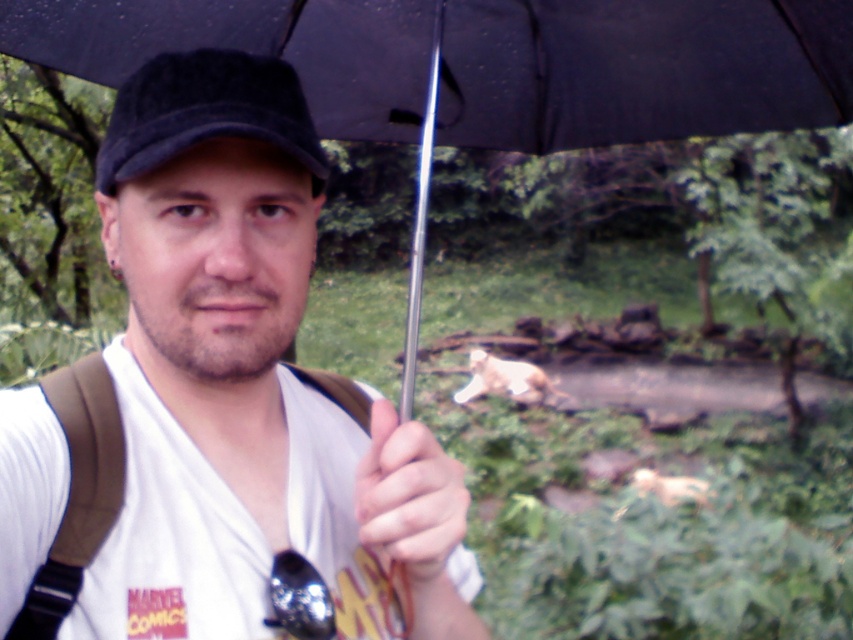
Based on the photo, can you confirm if black fuzzy baseball cap at center is positioned to the left of smooth skin hand at center?

Correct, you'll find black fuzzy baseball cap at center to the left of smooth skin hand at center.

Who is more forward, (155, 80) or (448, 484)?

Point (448, 484) is more forward.

Which is behind, point (315, 186) or point (401, 452)?

Point (315, 186)

You are a GUI agent. You are given a task and a screenshot of the screen. Output one action in this format:
    pyautogui.click(x=<x>, y=<y>)
    Task: Click on the black fuzzy baseball cap at center
    
    Given the screenshot: What is the action you would take?
    pyautogui.click(x=206, y=113)

Can you confirm if white matte t-shirt at center is bigger than smooth skin hand at center?

Yes, white matte t-shirt at center is bigger than smooth skin hand at center.

Who is lower down, white matte t-shirt at center or smooth skin hand at center?

smooth skin hand at center is lower down.

Locate an element on the screen. This screenshot has width=853, height=640. white matte t-shirt at center is located at coordinates (245, 385).

Does black matte umbrella at upper center have a lesser width compared to smooth skin hand at center?

Incorrect, black matte umbrella at upper center's width is not less than smooth skin hand at center's.

Can you confirm if black matte umbrella at upper center is positioned above smooth skin hand at center?

Correct, black matte umbrella at upper center is located above smooth skin hand at center.

Describe the element at coordinates (486, 68) in the screenshot. I see `black matte umbrella at upper center` at that location.

I want to click on black matte umbrella at upper center, so click(x=486, y=68).